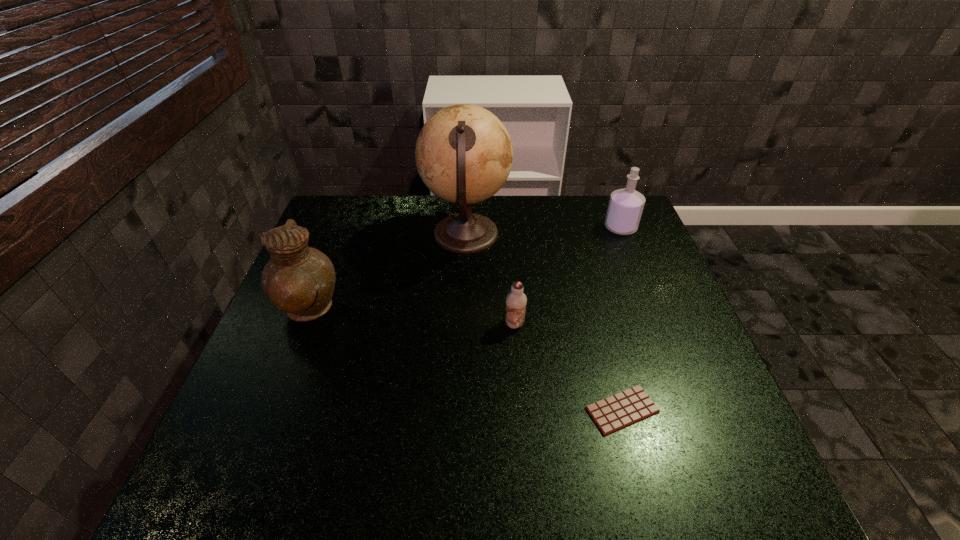
What are the coordinates of `free location that satisfies the following two spatial constraints: 1. at the spout of the pitcher; 2. on the right side of the shortest object` in the screenshot? It's located at (269, 410).

You are a GUI agent. You are given a task and a screenshot of the screen. Output one action in this format:
    pyautogui.click(x=<x>, y=<y>)
    Task: Click on the vacant space that satisfies the following two spatial constraints: 1. on the back side of the second shortest object; 2. on the front-facing side of the globe
    This screenshot has width=960, height=540.
    Given the screenshot: What is the action you would take?
    pyautogui.click(x=508, y=235)

Where is `vacant space that satisfies the following two spatial constraints: 1. on the front-facing side of the tallest object; 2. on the back side of the candy bar`? Image resolution: width=960 pixels, height=540 pixels. vacant space that satisfies the following two spatial constraints: 1. on the front-facing side of the tallest object; 2. on the back side of the candy bar is located at coordinates (459, 410).

Where is `free spot that satisfies the following two spatial constraints: 1. on the front-facing side of the nearest object; 2. on the left side of the globe`? Image resolution: width=960 pixels, height=540 pixels. free spot that satisfies the following two spatial constraints: 1. on the front-facing side of the nearest object; 2. on the left side of the globe is located at coordinates (459, 410).